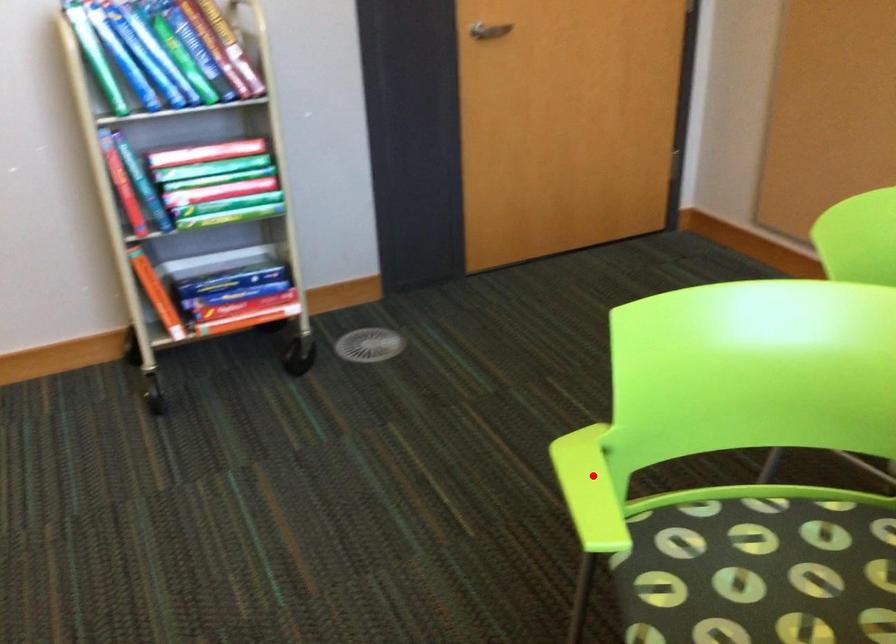
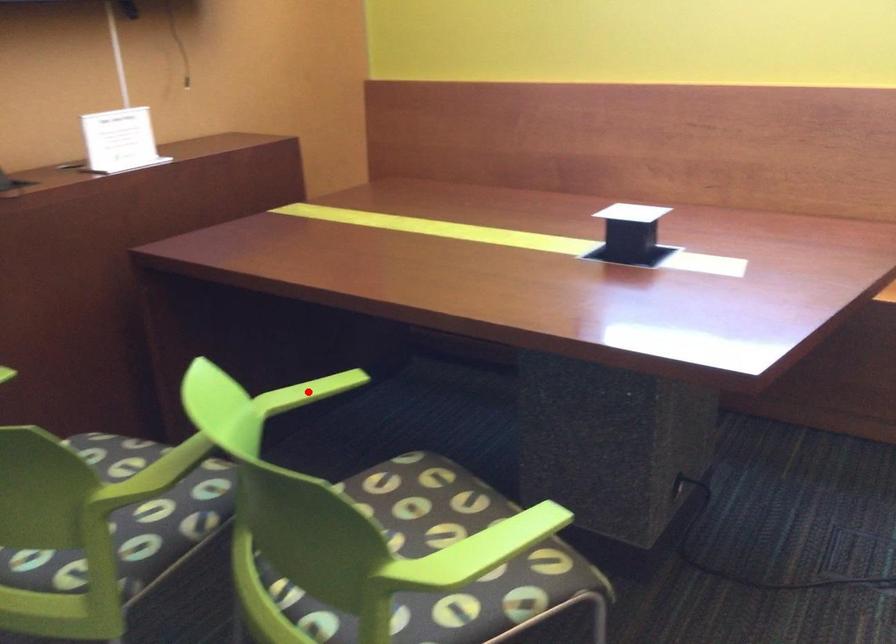
I am providing you with two images of the same scene from different viewpoints. A red point is marked on the first image and another point is marked on the second image. Are the points marked in image1 and image2 representing the same 3D position?

No